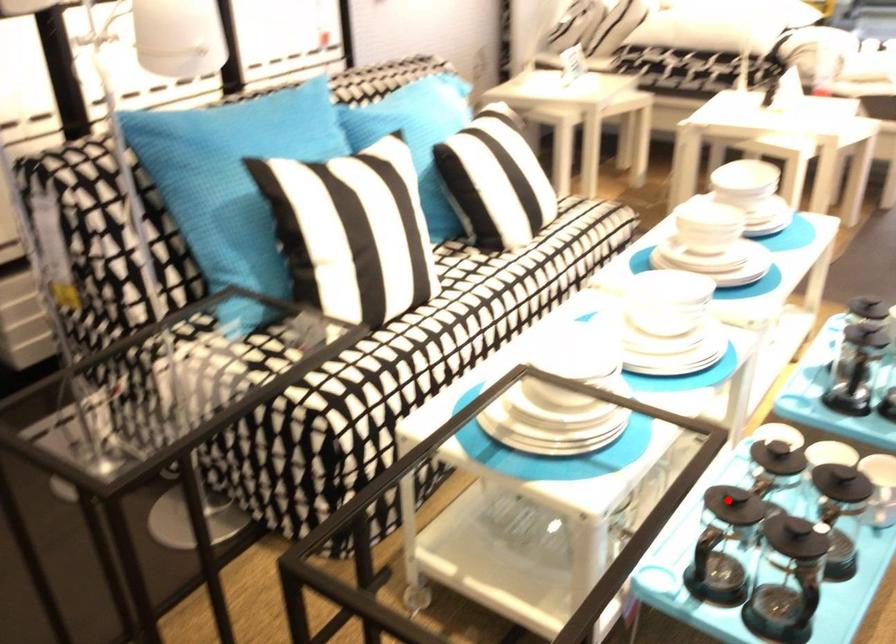
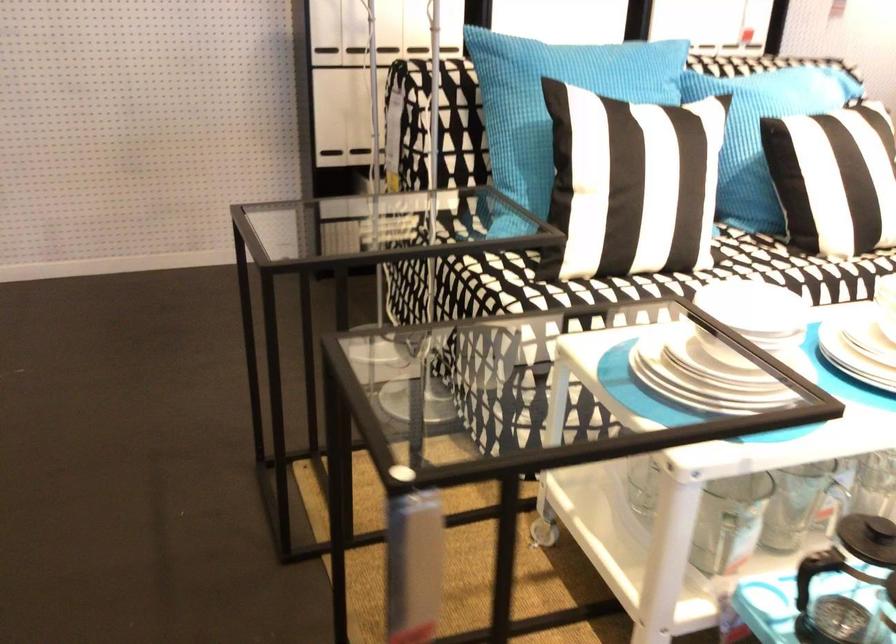
Find the pixel in the second image that matches the highlighted location in the first image.

(867, 538)